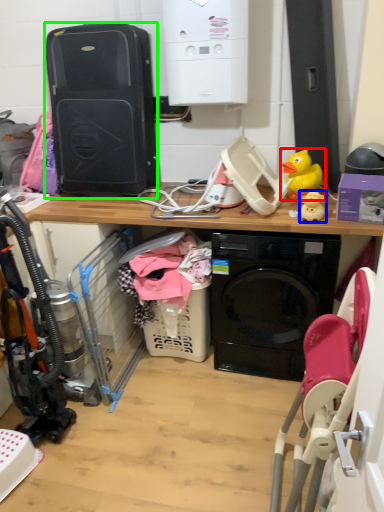
Question: Considering the real-world distances, which object is closest to toy (highlighted by a red box)? toy (highlighted by a blue box) or computer tower (highlighted by a green box).

Choices:
 (A) toy
 (B) computer tower

Answer: (A)